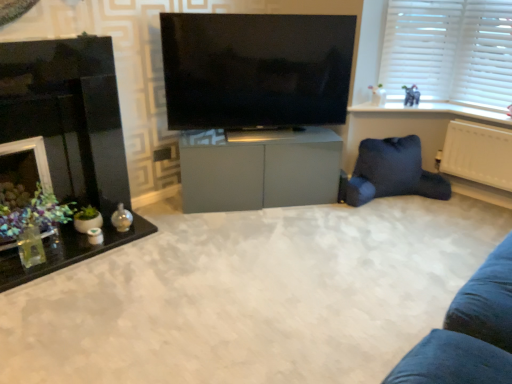
Locate an element on the screen. Image resolution: width=512 pixels, height=384 pixels. free space underneath dark blue fabric bean bag at lower right (from a real-world perspective) is located at coordinates (399, 200).